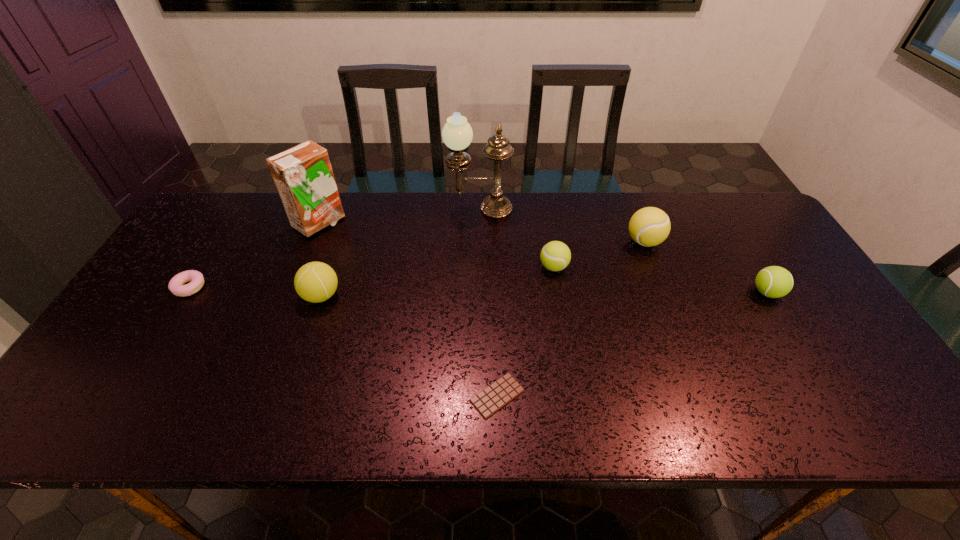
Locate an element on the screen. the shortest object is located at coordinates (497, 395).

This screenshot has height=540, width=960. What are the coordinates of `candy bar` in the screenshot? It's located at (497, 395).

Identify the location of vacant space located 0.290m on the left of the oil lamp. (359, 208).

Find the location of a particular element. Image resolution: width=960 pixels, height=540 pixels. vacant area located 0.300m on the straw side of the carton is located at coordinates (438, 224).

At what (x,y) coordinates should I click in order to perform the action: click on free point located on the left of the second object from right to left. Please return your answer as a coordinate pair (x, y). This screenshot has height=540, width=960. Looking at the image, I should click on (580, 242).

Find the location of a particular element. The image size is (960, 540). vacant space situated on the back of the leftmost tennis ball is located at coordinates (333, 259).

Find the location of a particular element. vacant space located 0.060m on the left of the sixth object from left to right is located at coordinates (518, 267).

Find the location of `vacant space located on the left of the rightmost object`. vacant space located on the left of the rightmost object is located at coordinates (693, 293).

Locate an element on the screen. Image resolution: width=960 pixels, height=540 pixels. vacant space situated on the right of the leftmost object is located at coordinates (332, 288).

Locate an element on the screen. free space located 0.260m on the back of the shortest object is located at coordinates (494, 291).